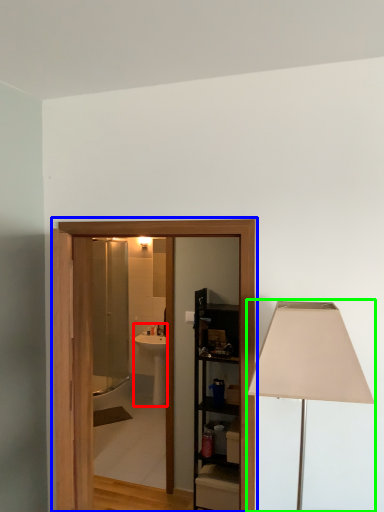
Question: Considering the real-world distances, which object is closest to sink (highlighted by a red box)? barn door (highlighted by a blue box) or lamp (highlighted by a green box).

Choices:
 (A) barn door
 (B) lamp

Answer: (A)